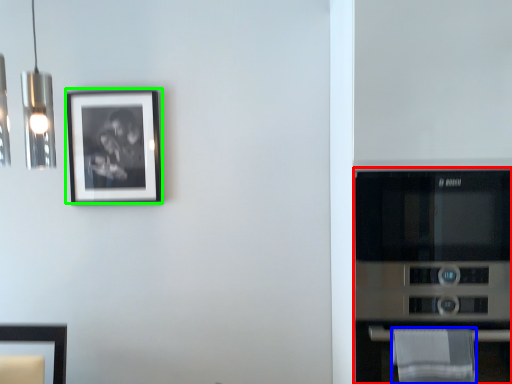
Question: Which is farther away from appliance (highlighted by a red box)? cloth (highlighted by a blue box) or picture frame (highlighted by a green box)?

Choices:
 (A) cloth
 (B) picture frame

Answer: (B)